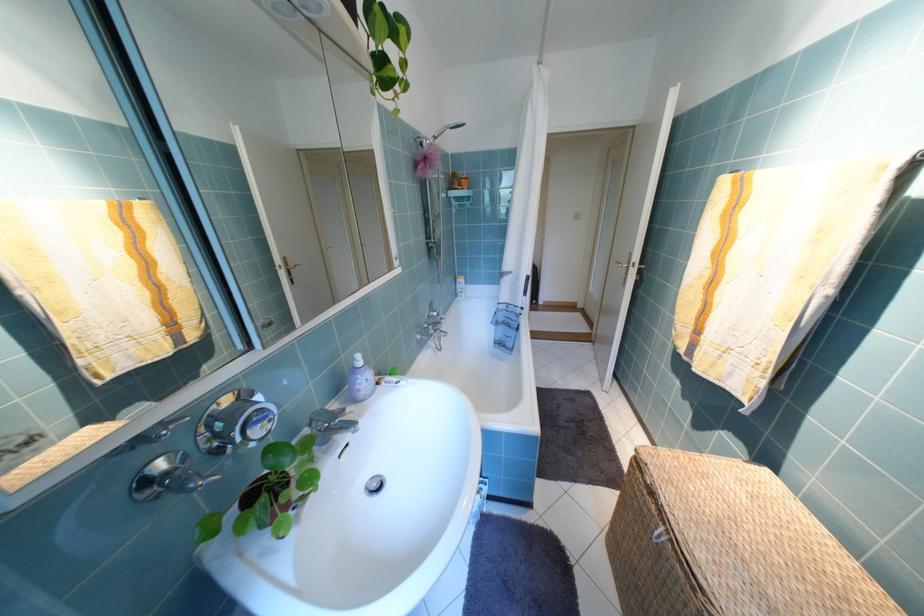
This screenshot has height=616, width=924. What are the coordinates of `purple soap dispenser pump` in the screenshot? It's located at (357, 360).